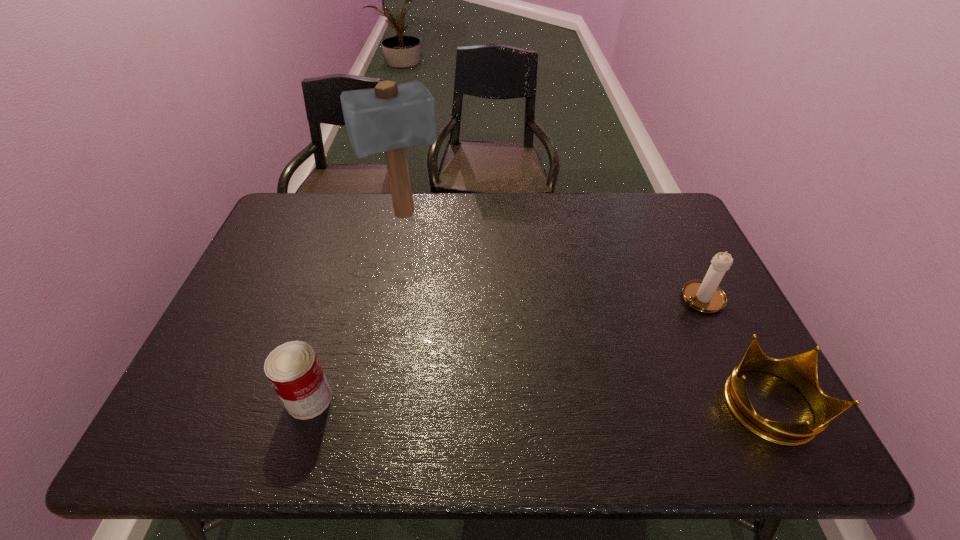
Identify the location of the third tallest object. (293, 369).

In order to click on the shortest object in this screenshot , I will do `click(800, 370)`.

What are the coordinates of `the tallest object` in the screenshot? It's located at (388, 118).

This screenshot has height=540, width=960. What are the coordinates of `mallet` in the screenshot? It's located at (388, 118).

I want to click on candle holder, so click(x=704, y=295).

Identify the location of vacant space located 0.120m on the front label of the third tallest object. (235, 399).

Find the location of `free space located on the front label of the third tallest object`. free space located on the front label of the third tallest object is located at coordinates pos(256,399).

What are the coordinates of `vacant region located 0.160m on the front label of the third tallest object` in the screenshot? It's located at (217, 399).

The width and height of the screenshot is (960, 540). I want to click on free location located 0.130m on the back of the shortest object, so click(726, 323).

You are a GUI agent. You are given a task and a screenshot of the screen. Output one action in this format:
    pyautogui.click(x=<x>, y=<y>)
    Task: Click on the vacant area situated 0.250m on the striking surface of the tallest object
    
    Given the screenshot: What is the action you would take?
    pyautogui.click(x=439, y=286)